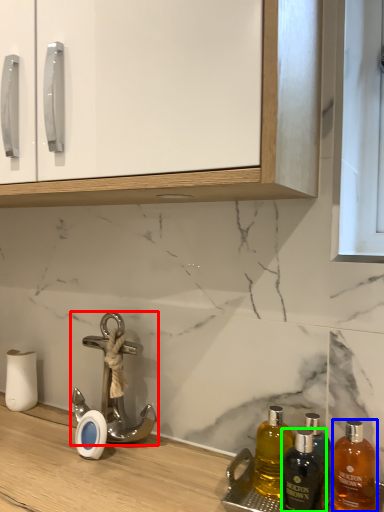
Question: Which object is positioned closest to tap (highlighted by a red box)? Select from bottle (highlighted by a blue box) and bottle (highlighted by a green box).

Choices:
 (A) bottle
 (B) bottle

Answer: (B)